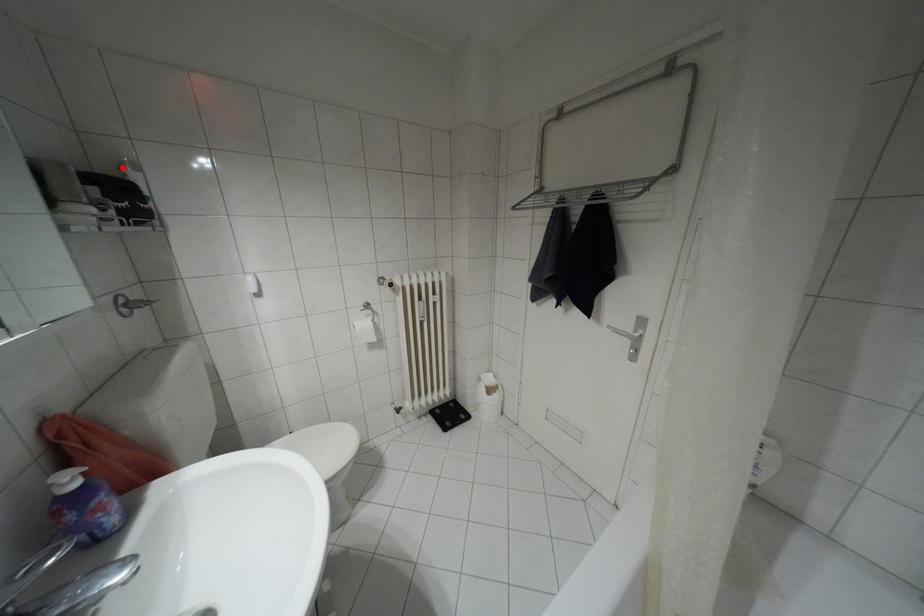
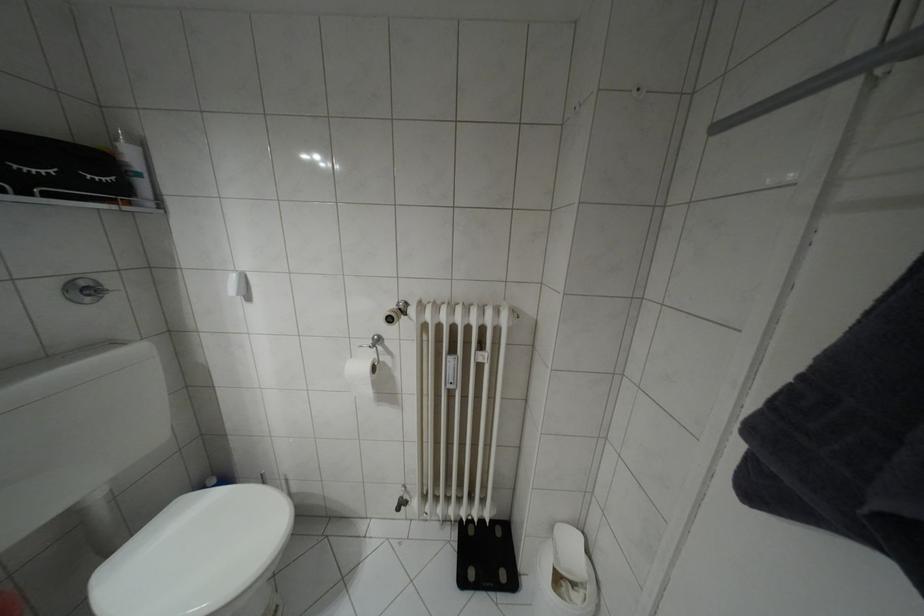
Where in the second image is the point corresponding to the highlighted location from the first image?

(116, 139)